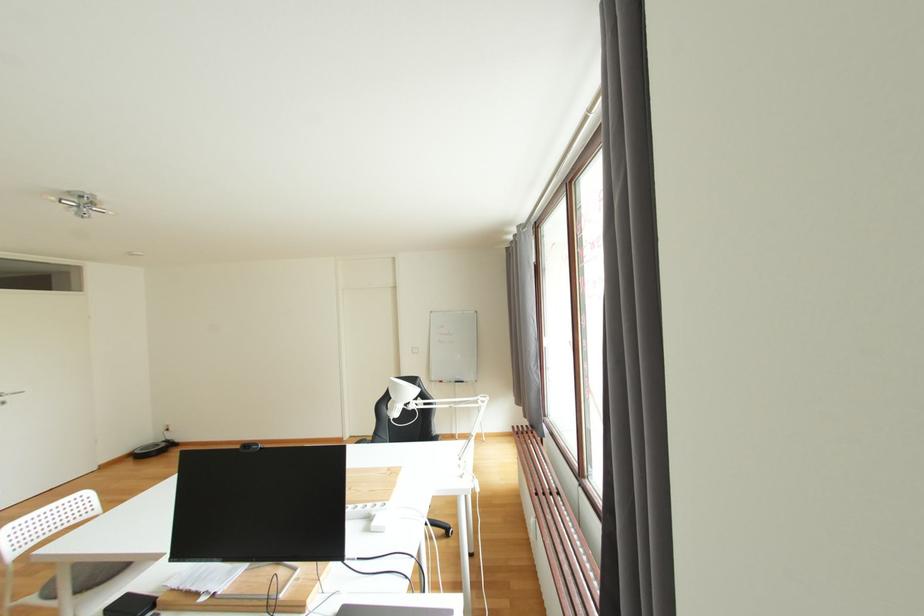
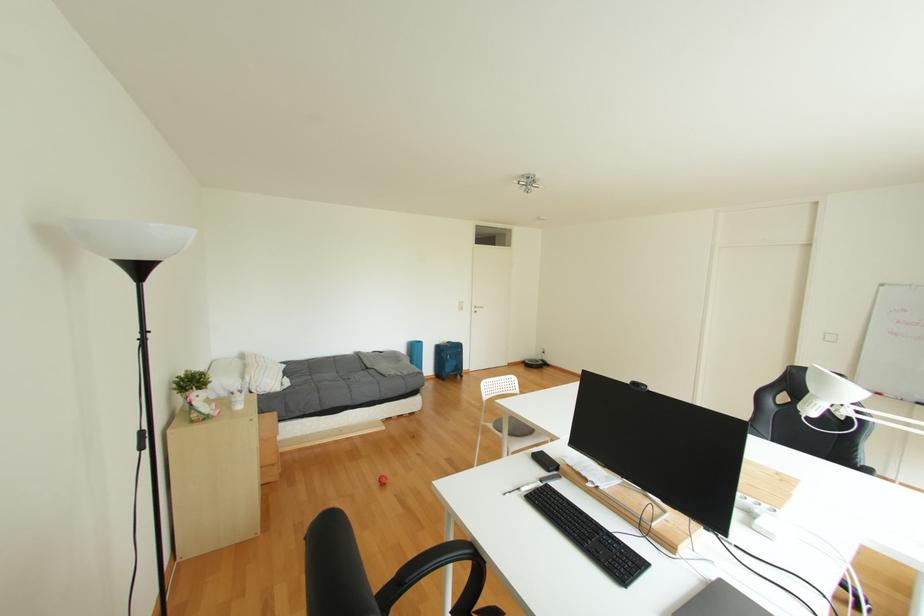
Question: How did the camera likely rotate?

Choices:
 (A) Left
 (B) Right
 (C) Up
 (D) Down

Answer: (A)